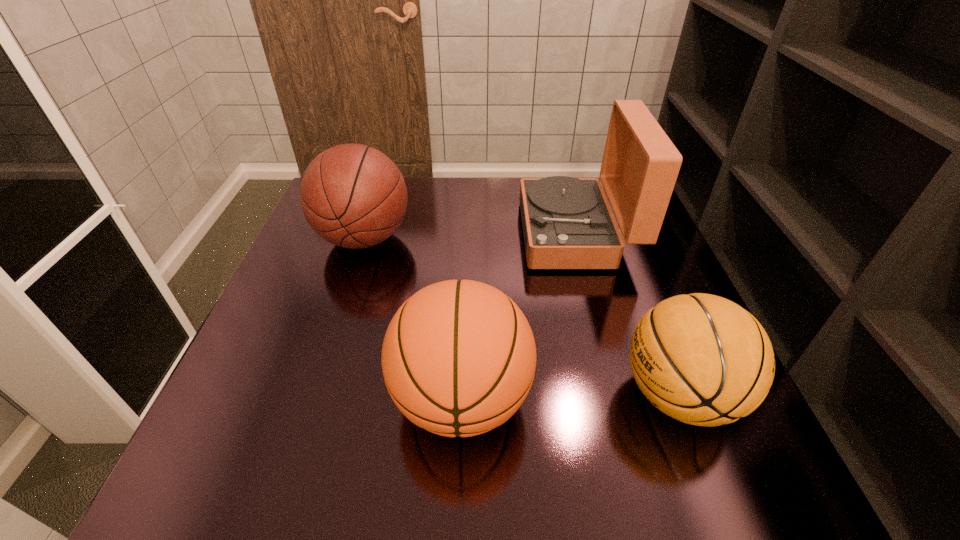
What are the coordinates of `the tallest object` in the screenshot? It's located at (567, 222).

Identify the location of the farthest basketball. The width and height of the screenshot is (960, 540). (354, 196).

Locate an element on the screen. The image size is (960, 540). the leftmost object is located at coordinates (354, 196).

Find the location of a particular element. the second basketball from left to right is located at coordinates (458, 358).

Locate an element on the screen. the shortest object is located at coordinates (702, 359).

At what (x,y) coordinates should I click in order to perform the action: click on the rightmost basketball. Please return your answer as a coordinate pair (x, y). Looking at the image, I should click on (702, 359).

At what (x,y) coordinates should I click in order to perform the action: click on free region located 0.070m on the face of the tallest object. Please return your answer as a coordinate pair (x, y). Looking at the image, I should click on (495, 233).

Identify the location of free space located on the face of the tallest object. (445, 233).

Locate an element on the screen. The width and height of the screenshot is (960, 540). blank space located 0.120m on the face of the tallest object is located at coordinates (476, 233).

This screenshot has width=960, height=540. In order to click on free spot located 0.130m on the right of the leftmost basketball in this screenshot , I will do `click(463, 239)`.